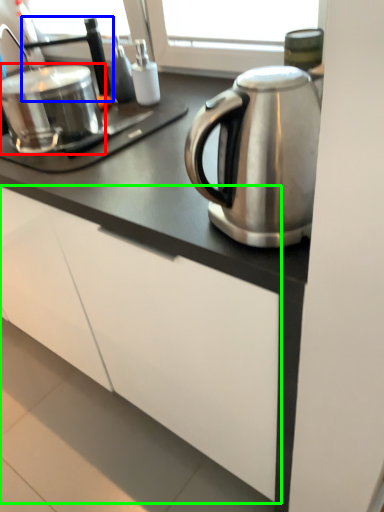
Question: Which object is the closest to the appliance (highlighted by a red box)? Choose among these: faucet (highlighted by a blue box) or cabinetry (highlighted by a green box).

Choices:
 (A) faucet
 (B) cabinetry

Answer: (A)